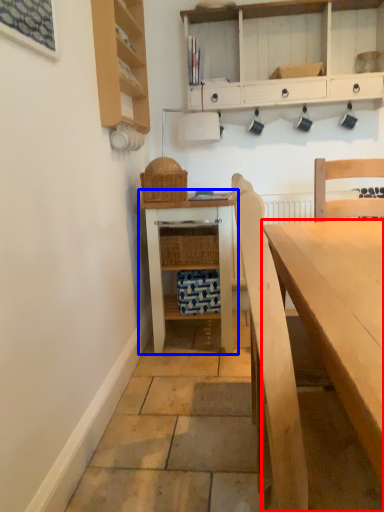
Question: Which of the following is the farthest to the observer, desk (highlighted by a red box) or table (highlighted by a blue box)?

Choices:
 (A) desk
 (B) table

Answer: (B)